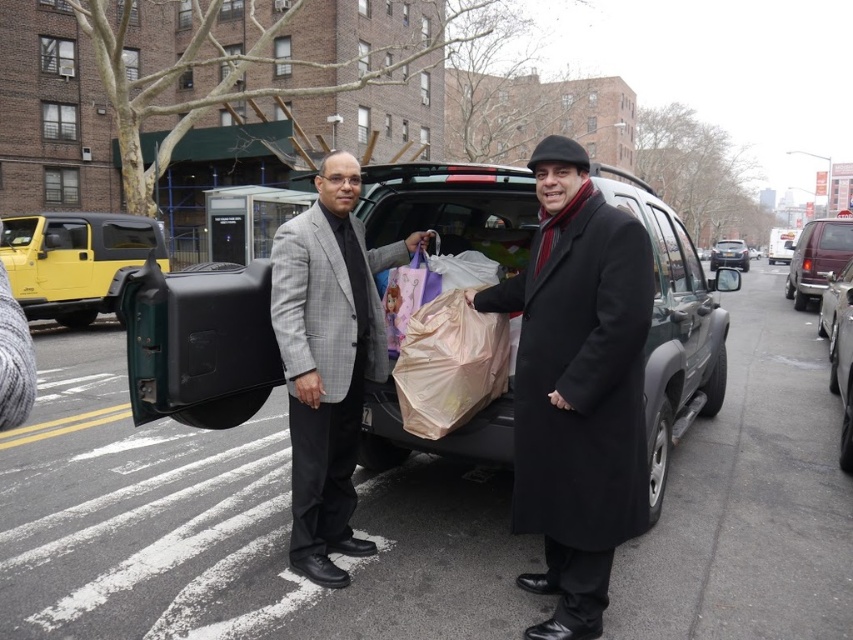
Question: Does yellow matte jeep at left appear over metallic silver sedan at center?

Choices:
 (A) no
 (B) yes

Answer: (A)

Question: Which point is closer to the camera taking this photo?

Choices:
 (A) (305, 401)
 (B) (579, 248)

Answer: (B)

Question: Does black wool coat at center have a larger size compared to metallic silver sedan at center?

Choices:
 (A) no
 (B) yes

Answer: (A)

Question: Does black wool coat at center have a greater width compared to maroon metallic van at right?

Choices:
 (A) no
 (B) yes

Answer: (A)

Question: Estimate the real-world distances between objects in this image. Which object is farther from the maroon metallic van at right?

Choices:
 (A) yellow matte jeep at left
 (B) metallic silver sedan at center
 (C) gray wool suit at center
 (D) black matte car at center

Answer: (D)

Question: Which point is farther from the camera taking this photo?

Choices:
 (A) (299, 358)
 (B) (369, 205)
 (C) (792, 257)
 (D) (740, 253)

Answer: (D)